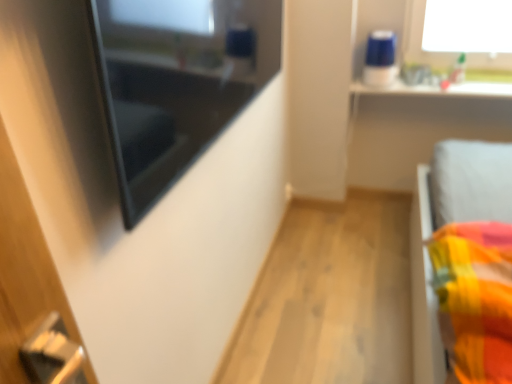
This screenshot has width=512, height=384. I want to click on matte black mirror at upper left, so click(176, 82).

Describe the element at coordinates (176, 82) in the screenshot. I see `matte black mirror at upper left` at that location.

Consider the image. What is the approximate width of matte black mirror at upper left?

4.98 inches.

This screenshot has width=512, height=384. Identify the location of white glossy window sill at upper right. (440, 88).

The width and height of the screenshot is (512, 384). What do you see at coordinates (440, 88) in the screenshot?
I see `white glossy window sill at upper right` at bounding box center [440, 88].

At what (x,y) coordinates should I click in order to perform the action: click on matte black mirror at upper left. Please return your answer as a coordinate pair (x, y). This screenshot has height=384, width=512. Looking at the image, I should click on (176, 82).

Considering the positions of objects matte black mirror at upper left and white glossy window sill at upper right in the image provided, who is more to the left, matte black mirror at upper left or white glossy window sill at upper right?

matte black mirror at upper left.

Considering their positions, is matte black mirror at upper left located in front of or behind white glossy window sill at upper right?

Visually, matte black mirror at upper left is located in front of white glossy window sill at upper right.

Which is closer, (155, 17) or (367, 94)?

The point (155, 17) is in front.

From the image's perspective, which object appears higher, matte black mirror at upper left or white glossy window sill at upper right?

white glossy window sill at upper right appears higher in the image.

From a real-world perspective, is matte black mirror at upper left located higher than white glossy window sill at upper right?

Yes, from a real-world perspective, matte black mirror at upper left is on top of white glossy window sill at upper right.

Is matte black mirror at upper left wider or thinner than white glossy window sill at upper right?

Considering their sizes, matte black mirror at upper left looks slimmer than white glossy window sill at upper right.

Considering the sizes of objects matte black mirror at upper left and white glossy window sill at upper right in the image provided, who is taller, matte black mirror at upper left or white glossy window sill at upper right?

matte black mirror at upper left.

From the picture: In terms of size, does matte black mirror at upper left appear bigger or smaller than white glossy window sill at upper right?

In the image, matte black mirror at upper left appears to be larger than white glossy window sill at upper right.

Is matte black mirror at upper left positioned beyond the bounds of white glossy window sill at upper right?

Yes, matte black mirror at upper left is not within white glossy window sill at upper right.

Is the surface of matte black mirror at upper left in direct contact with white glossy window sill at upper right?

They are not placed beside each other.

Is matte black mirror at upper left looking in the opposite direction of white glossy window sill at upper right?

matte black mirror at upper left is not turned away from white glossy window sill at upper right.

What's the angular difference between matte black mirror at upper left and white glossy window sill at upper right's facing directions?

The angle between the facing direction of matte black mirror at upper left and the facing direction of white glossy window sill at upper right is 89.9 degrees.

Locate an element on the screen. The height and width of the screenshot is (384, 512). medicine cabinet in front of the white glossy window sill at upper right is located at coordinates (176, 82).

From the picture: Does white glossy window sill at upper right appear on the left side of matte black mirror at upper left?

In fact, white glossy window sill at upper right is to the right of matte black mirror at upper left.

Is the position of white glossy window sill at upper right less distant than that of matte black mirror at upper left?

No.

Does point (362, 85) lie in front of point (137, 70)?

No, it is behind (137, 70).

From the image's perspective, who appears lower, white glossy window sill at upper right or matte black mirror at upper left?

From the image's view, matte black mirror at upper left is below.

From a real-world perspective, between white glossy window sill at upper right and matte black mirror at upper left, who is vertically lower?

From a 3D spatial view, white glossy window sill at upper right is below.

Considering the relative sizes of white glossy window sill at upper right and matte black mirror at upper left in the image provided, is white glossy window sill at upper right wider than matte black mirror at upper left?

Indeed, white glossy window sill at upper right has a greater width compared to matte black mirror at upper left.

Who is taller, white glossy window sill at upper right or matte black mirror at upper left?

Standing taller between the two is matte black mirror at upper left.

Looking at the image, does white glossy window sill at upper right seem bigger or smaller compared to matte black mirror at upper left?

In the image, white glossy window sill at upper right appears to be smaller than matte black mirror at upper left.

Is white glossy window sill at upper right not inside matte black mirror at upper left?

white glossy window sill at upper right is positioned outside matte black mirror at upper left.

Is there a large distance between white glossy window sill at upper right and matte black mirror at upper left?

Yes, white glossy window sill at upper right and matte black mirror at upper left are quite far apart.

Is matte black mirror at upper left at the back of white glossy window sill at upper right?

No, matte black mirror at upper left is not at the back of white glossy window sill at upper right.

Where is `medicine cabinet below the white glossy window sill at upper right (from the image's perspective)`? This screenshot has height=384, width=512. medicine cabinet below the white glossy window sill at upper right (from the image's perspective) is located at coordinates (176, 82).

Where is `window sill on the right of the matte black mirror at upper left`? This screenshot has width=512, height=384. window sill on the right of the matte black mirror at upper left is located at coordinates (440, 88).

The image size is (512, 384). In order to click on medicine cabinet located above the white glossy window sill at upper right (from a real-world perspective) in this screenshot , I will do `click(176, 82)`.